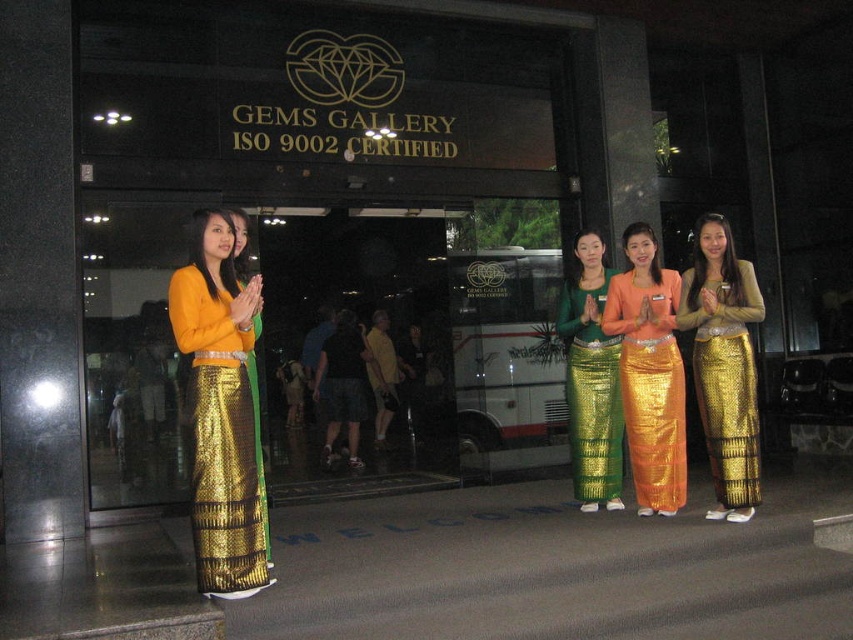
You are a photographer trying to capture the matte gold skirt at left and the green sequined skirt at center in the same frame. Since the two skirts are overlapping, which one will appear in front in the photo?

The matte gold skirt at left is positioned over green sequined skirt at center, so it will appear in front in the photo.

Consider the image. You are a photographer preparing to take a group photo of the women in front of the GEMS GALLERY sign. You need to ensure that both the gold sequined skirt at center and the green sequined skirt at center are fully visible in the frame. Given that the camera has a fixed width, which of the two skirts requires more horizontal space to be captured in full?

The gold sequened skirt at center requires more horizontal space because its width surpasses that of the green sequined skirt at center.

You are standing at the entrance of the GEMS GALLERY and notice a point marked at coordinates (221,412). Which object does this point correspond to?

The point at coordinates (221,412) corresponds to the matte gold skirt at left.